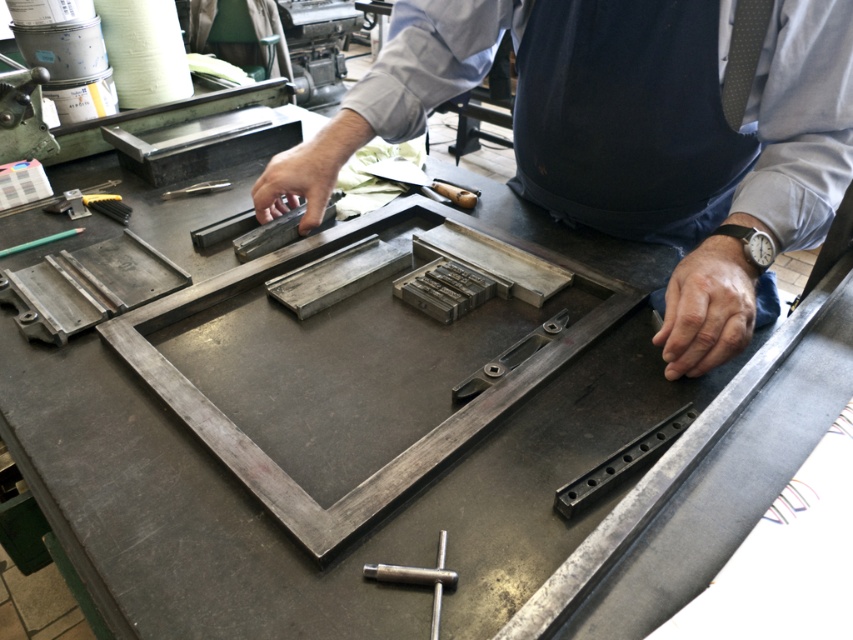
Question: Which of the following is the closest to the observer?

Choices:
 (A) metallic gray metal bar at center
 (B) metallic gray frame at center
 (C) dark blue fabric apron at center

Answer: (B)

Question: Which object appears farthest from the camera in this image?

Choices:
 (A) silver metallic wrench at center
 (B) metallic gray tool at center

Answer: (B)

Question: In this image, where is black metal/steel at lower right located relative to metallic gray handle at center?

Choices:
 (A) right
 (B) left

Answer: (A)

Question: Which object is positioned closest to the metallic gray handle at center?

Choices:
 (A) metallic gray frame at center
 (B) metallic silver tool at center
 (C) metallic wood-handled tool at center

Answer: (A)

Question: Does metallic gray frame at center appear on the left side of metallic gray metal bar at center?

Choices:
 (A) yes
 (B) no

Answer: (B)

Question: Can you confirm if black metal/steel at lower right is positioned below silver metallic wrench at center?

Choices:
 (A) no
 (B) yes

Answer: (A)